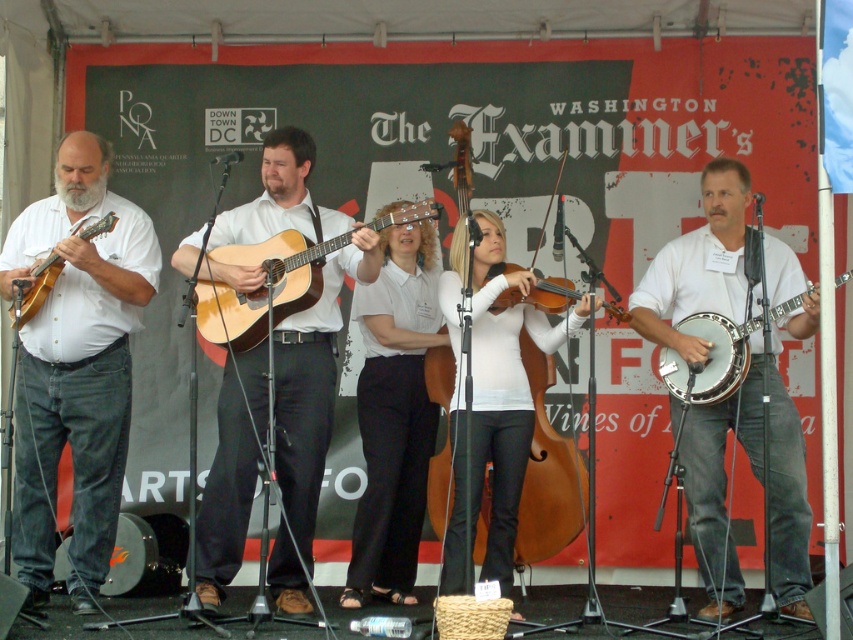
Question: Estimate the real-world distances between objects in this image. Which object is farther from the matte wood mandolin at left?

Choices:
 (A) wooden acoustic guitar at center
 (B) white glossy shirt at center
 (C) matte brown banjo at right

Answer: (C)

Question: Considering the relative positions of light brown acoustic guitar at center and matte wood mandolin at left in the image provided, where is light brown acoustic guitar at center located with respect to matte wood mandolin at left?

Choices:
 (A) above
 (B) below

Answer: (A)

Question: Can you confirm if matte brown banjo at right is positioned to the right of matte wood mandolin at left?

Choices:
 (A) yes
 (B) no

Answer: (A)

Question: Can you confirm if light brown acoustic guitar at center is wider than matte wood mandolin at left?

Choices:
 (A) yes
 (B) no

Answer: (A)

Question: Considering the real-world distances, which object is farthest from the wooden acoustic guitar at center?

Choices:
 (A) light brown acoustic guitar at center
 (B) white glossy shirt at center
 (C) matte wood mandolin at left

Answer: (C)

Question: Which object is positioned farthest from the white matte violin at center?

Choices:
 (A) light brown acoustic guitar at center
 (B) white matte banjo at center
 (C) matte white shirt at left

Answer: (C)